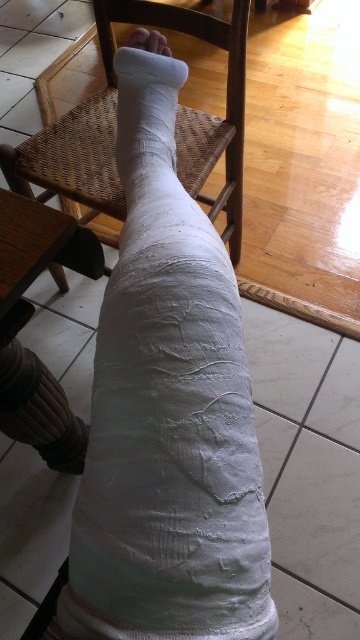
You are a physical therapist examining the scene. You need to adjust the position of the white matte plaster bandage at lower center and the woven wood chair at center. Which object is positioned to the right side of the other?

The white matte plaster bandage at lower center is to the right of the woven wood chair at center.

You are a physical therapist examining a patient. You notice the white matte plaster bandage at lower center and the woven wood chair at center. Which object has a smaller width when viewed from above?

The white matte plaster bandage at lower center is thinner than the woven wood chair at center, so the white matte plaster bandage at lower center has a smaller width when viewed from above.

You are a physical therapist examining a patient. You notice the white matte plaster bandage at lower center and the woven wood chair at center. Which object is closer to your line of sight?

The white matte plaster bandage at lower center is closer to the viewer than the woven wood chair at center, so the plaster bandage is closer to your line of sight.